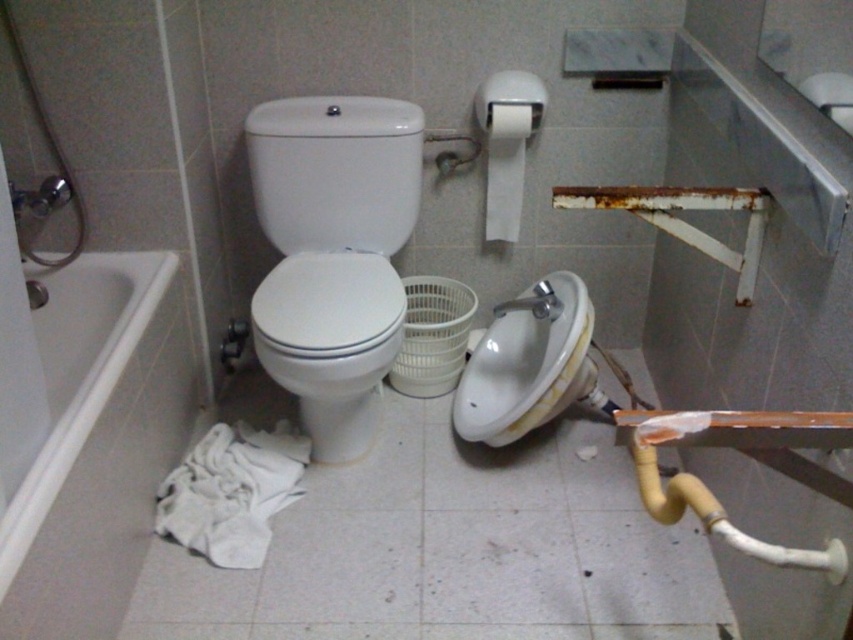
Question: Which point is farther to the camera?

Choices:
 (A) white glossy toilet at center
 (B) white glossy sink at center
 (C) white matte toilet paper at upper center

Answer: (C)

Question: Which point appears farthest from the camera in this image?

Choices:
 (A) (613, 404)
 (B) (486, 204)
 (C) (38, 547)

Answer: (B)

Question: Which of the following is the closest to the observer?

Choices:
 (A) (19, 545)
 (B) (328, 456)
 (C) (534, 323)

Answer: (A)

Question: Can you confirm if white glossy bathtub at lower left is positioned to the left of white matte toilet paper at upper center?

Choices:
 (A) yes
 (B) no

Answer: (A)

Question: Can you confirm if white glossy bathtub at lower left is bigger than white glossy toilet at center?

Choices:
 (A) yes
 (B) no

Answer: (A)

Question: Observing the image, what is the correct spatial positioning of white glossy bathtub at lower left in reference to white matte toilet paper at upper center?

Choices:
 (A) left
 (B) right

Answer: (A)